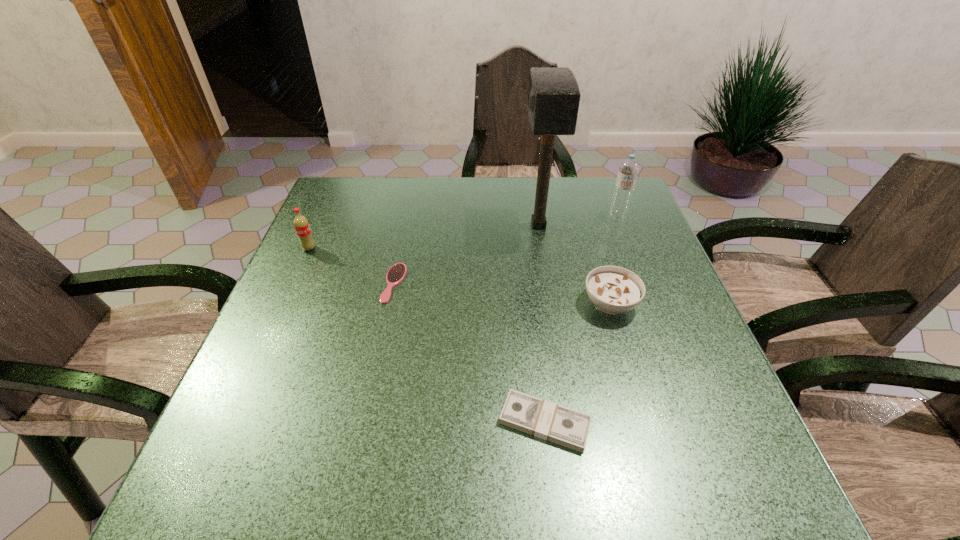
Where is `free spot that satisfies the following two spatial constraints: 1. on the front side of the soda; 2. on the right side of the dollar`? free spot that satisfies the following two spatial constraints: 1. on the front side of the soda; 2. on the right side of the dollar is located at coordinates (231, 422).